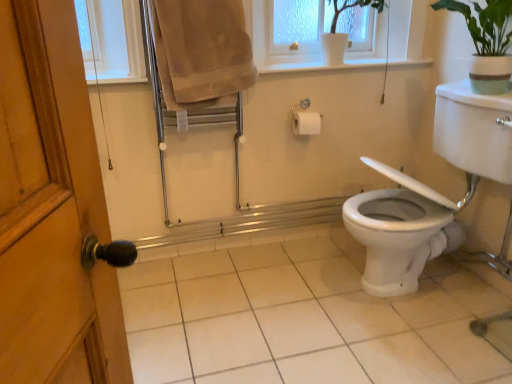
Question: Does point (371, 289) appear closer or farther from the camera than point (210, 87)?

Choices:
 (A) closer
 (B) farther

Answer: (B)

Question: From a real-world perspective, is white glossy sink at right above or below beige cotton towel at upper center?

Choices:
 (A) below
 (B) above

Answer: (A)

Question: Which object is positioned farthest from the white ceramic pot at upper center?

Choices:
 (A) white glossy sink at right
 (B) beige cotton towel at upper center
 (C) black rubber grab bar at lower left

Answer: (C)

Question: Considering the real-world distances, which object is closest to the white ceramic pot at upper center?

Choices:
 (A) beige cotton towel at upper center
 (B) black rubber grab bar at lower left
 (C) white glossy sink at right

Answer: (A)